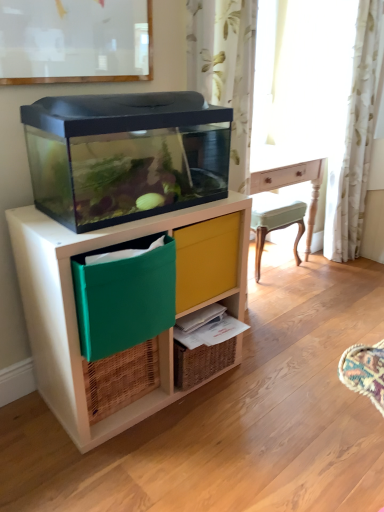
The image size is (384, 512). I want to click on space that is in front of woven wood shelf at lower center, so click(x=202, y=415).